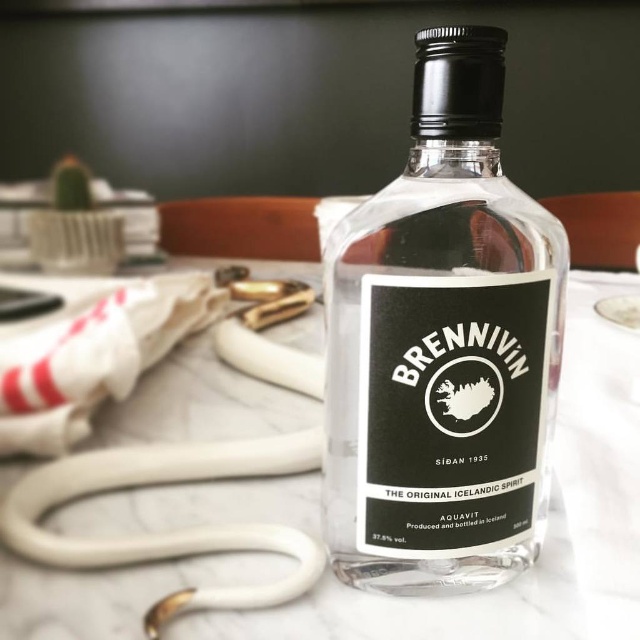
Is point (422, 321) more distant than point (179, 516)?

No, it is not.

Can you confirm if transparent glass bottle at center is taller than white marble table at center?

Yes.

You are a GUI agent. You are given a task and a screenshot of the screen. Output one action in this format:
    pyautogui.click(x=<x>, y=<y>)
    Task: Click on the transparent glass bottle at center
    This screenshot has height=640, width=640.
    Given the screenshot: What is the action you would take?
    pyautogui.click(x=442, y=346)